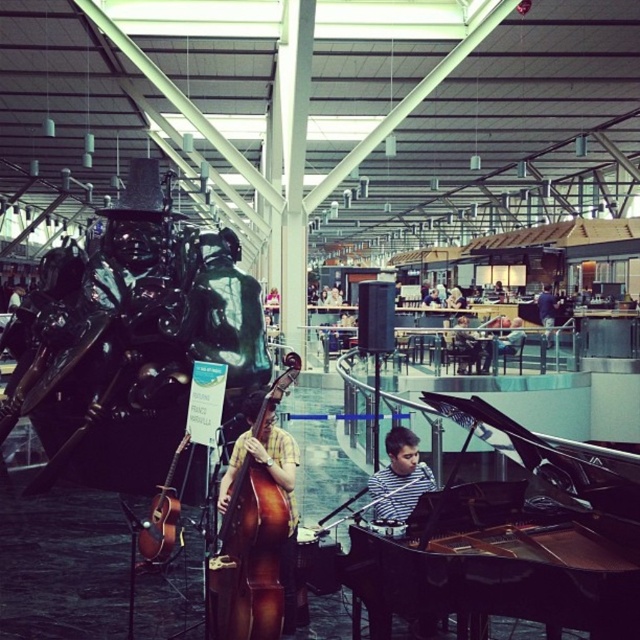
Question: Which object is farther from the camera taking this photo?

Choices:
 (A) wooden polished cello at center
 (B) dark blue shirt at center

Answer: (B)

Question: Which of the following is the closest to the observer?

Choices:
 (A) (369, 486)
 (B) (548, 300)
 (C) (260, 598)
 (D) (173, 516)

Answer: (C)

Question: Is black polished piano at center closer to the viewer compared to matte brown guitar at lower left?

Choices:
 (A) yes
 (B) no

Answer: (A)

Question: Can you confirm if wooden polished cello at center is positioned below dark blue shirt at center?

Choices:
 (A) yes
 (B) no

Answer: (A)

Question: Among these objects, which one is nearest to the camera?

Choices:
 (A) dark blue shirt at center
 (B) matte brown guitar at lower left

Answer: (B)

Question: Is black polished piano at center further to camera compared to dark blue shirt at center?

Choices:
 (A) no
 (B) yes

Answer: (A)